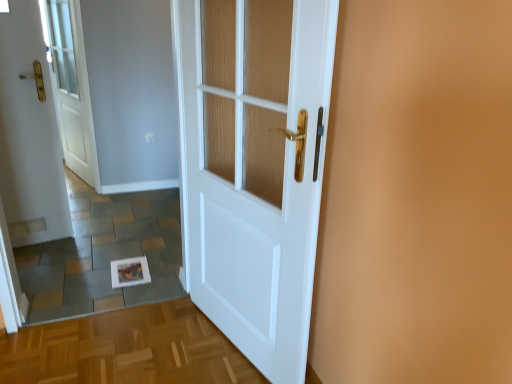
Question: Does white glossy door at left, the first door viewed from the left, have a smaller size compared to white wood door at center, which appears as the 2th door when viewed from the back?

Choices:
 (A) no
 (B) yes

Answer: (B)

Question: Could you tell me if white glossy door at left, arranged as the 1th door when viewed from the back, is turned towards white wood door at center, positioned as the first door in right-to-left order?

Choices:
 (A) no
 (B) yes

Answer: (A)

Question: From a real-world perspective, is white glossy door at left, the second door in the right-to-left sequence, located beneath white wood door at center, the second door viewed from the left?

Choices:
 (A) yes
 (B) no

Answer: (B)

Question: From the image's perspective, would you say white glossy door at left, arranged as the second door when viewed from the front, is shown under white wood door at center, the second door viewed from the left?

Choices:
 (A) no
 (B) yes

Answer: (A)

Question: Is white glossy door at left, arranged as the second door when viewed from the front, wider than white wood door at center, which appears as the 1th door when viewed from the front?

Choices:
 (A) no
 (B) yes

Answer: (A)

Question: Is white glossy door at left, arranged as the 1th door when viewed from the back, oriented away from white wood door at center, which appears as the 1th door when viewed from the front?

Choices:
 (A) no
 (B) yes

Answer: (A)

Question: From a real-world perspective, is white wood door at center, positioned as the first door in right-to-left order, below white glossy door at left, arranged as the second door when viewed from the front?

Choices:
 (A) yes
 (B) no

Answer: (A)

Question: Can you confirm if white wood door at center, positioned as the first door in right-to-left order, is positioned to the right of white glossy door at left, arranged as the second door when viewed from the front?

Choices:
 (A) yes
 (B) no

Answer: (A)

Question: Could you tell me if white wood door at center, positioned as the first door in right-to-left order, is turned towards white glossy door at left, arranged as the 1th door when viewed from the back?

Choices:
 (A) no
 (B) yes

Answer: (A)

Question: Is white wood door at center, positioned as the first door in right-to-left order, with white glossy door at left, arranged as the 1th door when viewed from the back?

Choices:
 (A) yes
 (B) no

Answer: (B)

Question: Is white glossy door at left, the first door viewed from the left, at the back of white wood door at center, which appears as the 1th door when viewed from the front?

Choices:
 (A) no
 (B) yes

Answer: (A)

Question: From a real-world perspective, does white wood door at center, which appears as the 1th door when viewed from the front, stand above white glossy door at left, arranged as the second door when viewed from the front?

Choices:
 (A) yes
 (B) no

Answer: (B)

Question: Looking at the image, does white glossy door at left, the first door viewed from the left, seem bigger or smaller compared to white wood door at center, which appears as the 1th door when viewed from the front?

Choices:
 (A) small
 (B) big

Answer: (A)